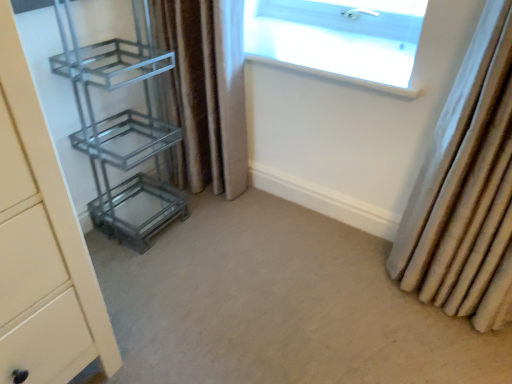
Question: Considering the positions of metallic glass shelf at left and transparent glass window at upper center in the image, is metallic glass shelf at left taller or shorter than transparent glass window at upper center?

Choices:
 (A) short
 (B) tall

Answer: (B)

Question: Considering the relative positions of metallic glass shelf at left and transparent glass window at upper center in the image provided, is metallic glass shelf at left to the left or to the right of transparent glass window at upper center?

Choices:
 (A) left
 (B) right

Answer: (A)

Question: Which is farther from the transparent glass window at upper center?

Choices:
 (A) metallic glass shelf at left
 (B) beige fabric curtain at right, which is counted as the 1th curtain, starting from the right
 (C) brown textured curtain at center, the 1th curtain in the left-to-right sequence
 (D) beige carpet at center

Answer: (D)

Question: Which of these objects is positioned closest to the brown textured curtain at center, the 1th curtain in the left-to-right sequence?

Choices:
 (A) transparent glass window at upper center
 (B) beige carpet at center
 (C) beige fabric curtain at right, marked as the second curtain in a left-to-right arrangement
 (D) metallic glass shelf at left

Answer: (D)